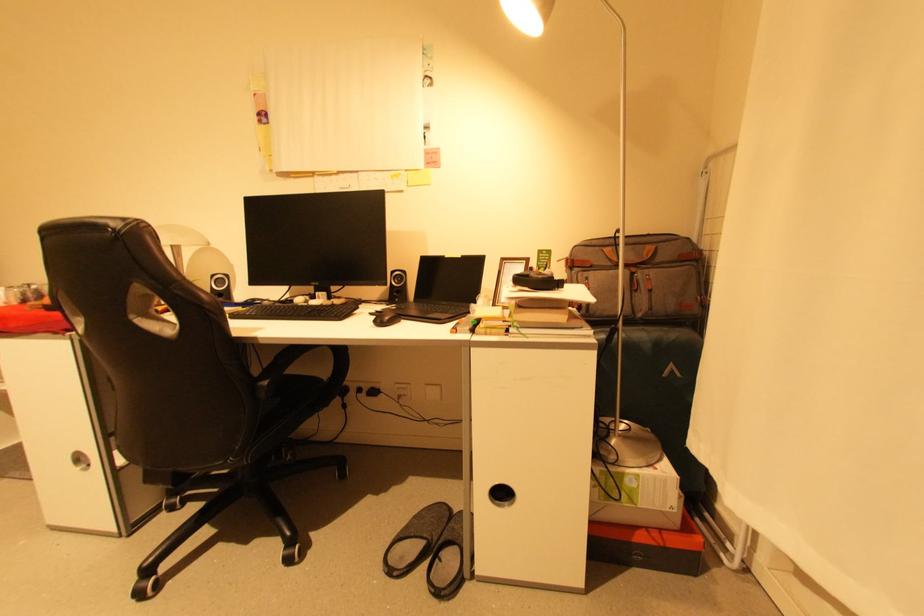
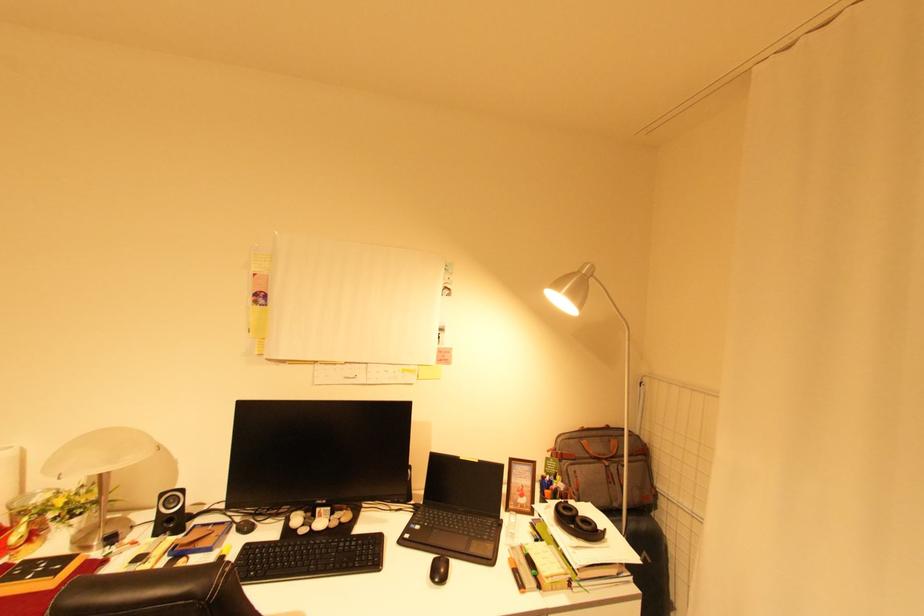
Question: Which direction would the cameraman need to move to produce the second image? Reply with the corresponding letter.

Choices:
 (A) Left
 (B) Right
 (C) Forward
 (D) Backward

Answer: (A)